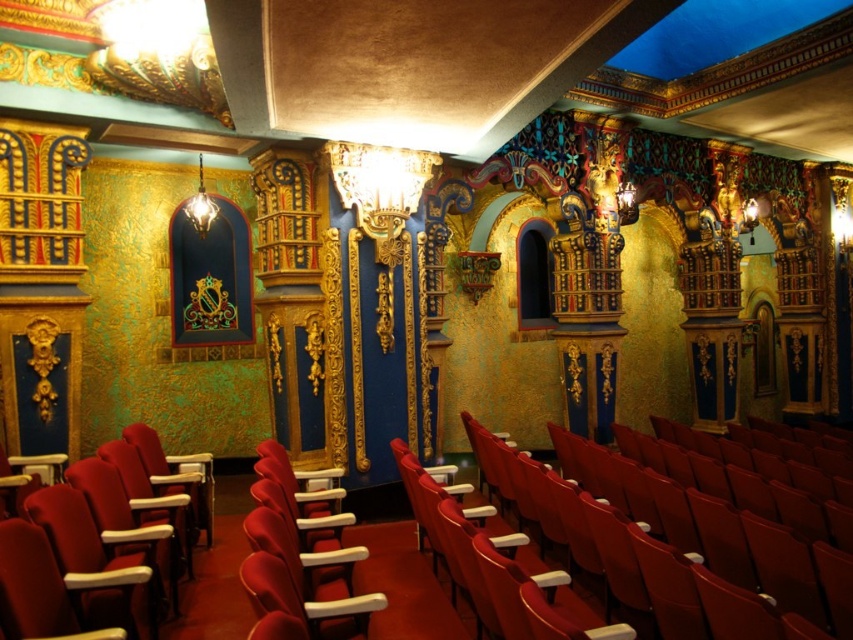
Question: Considering the relative positions of matte red seat at center and velvet red seat at left in the image provided, where is matte red seat at center located with respect to velvet red seat at left?

Choices:
 (A) right
 (B) left

Answer: (A)

Question: Which point is farther to the camera?

Choices:
 (A) click(x=80, y=580)
 (B) click(x=577, y=448)

Answer: (B)

Question: Can you confirm if matte red seat at center is positioned above velvet red seat at left?

Choices:
 (A) yes
 (B) no

Answer: (B)

Question: Considering the relative positions of matte red seat at center and velvet red seat at left in the image provided, where is matte red seat at center located with respect to velvet red seat at left?

Choices:
 (A) below
 (B) above

Answer: (A)

Question: Among these points, which one is nearest to the camera?

Choices:
 (A) (514, 536)
 (B) (184, 545)

Answer: (A)

Question: Which point appears farthest from the camera in this image?

Choices:
 (A) (640, 573)
 (B) (173, 504)

Answer: (B)